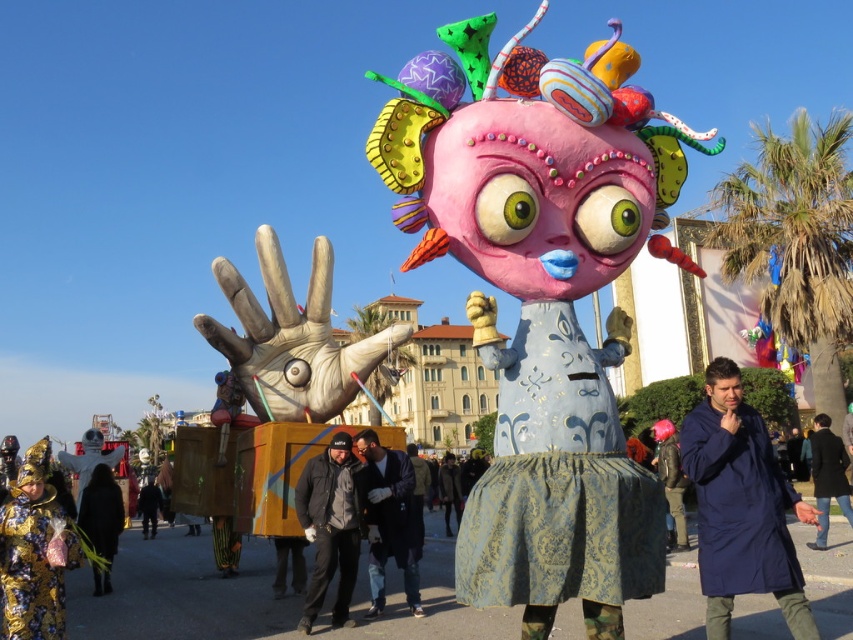
From the picture: You are an event organizer setting up a booth at the festival. You have a matte pink fabric at center and a dark blue jacket at center that need to be displayed on a single mannequin. Given their sizes, which item should be placed on top to ensure visibility?

The matte pink fabric at center should be placed on top since its width is larger than the dark blue jacket at center, making it more visually prominent.

You are a photographer standing at the camera position. You want to capture a closeup shot of the matte pink fabric at center. Given that your longest available lens allows focusing as close as 50 feet, will you be able to take the photo without moving closer?

The matte pink fabric at center is 78.98 feet away from camera, which is beyond the 50 feet minimum focus distance of your lens. Therefore, you cannot take the closeup shot without moving closer.

You are an observer standing in front of the scene. You see both the blue fabric coat at center and the black fabric jacket at center. Which one is positioned higher up?

The blue fabric coat at center is located above the black fabric jacket at center, so it is positioned higher up.